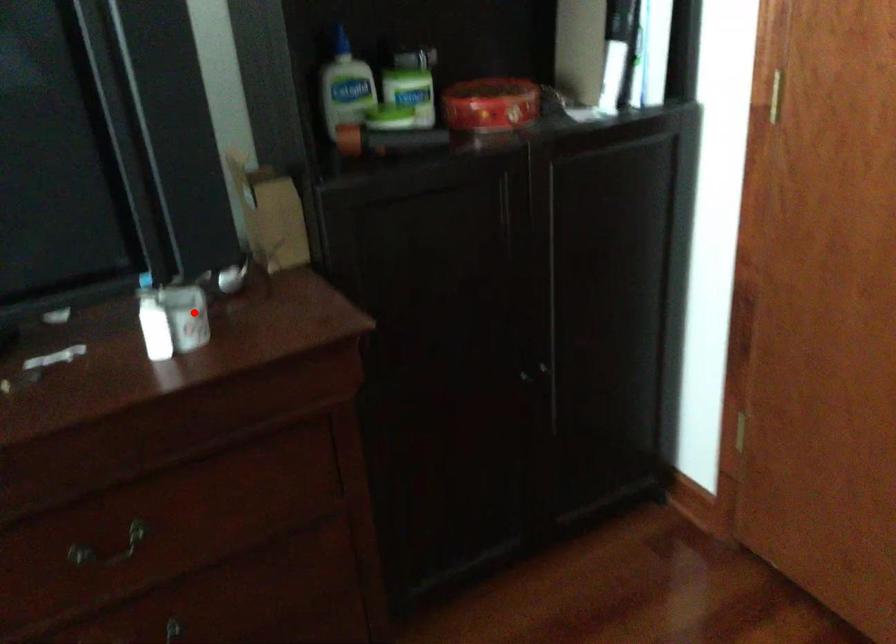
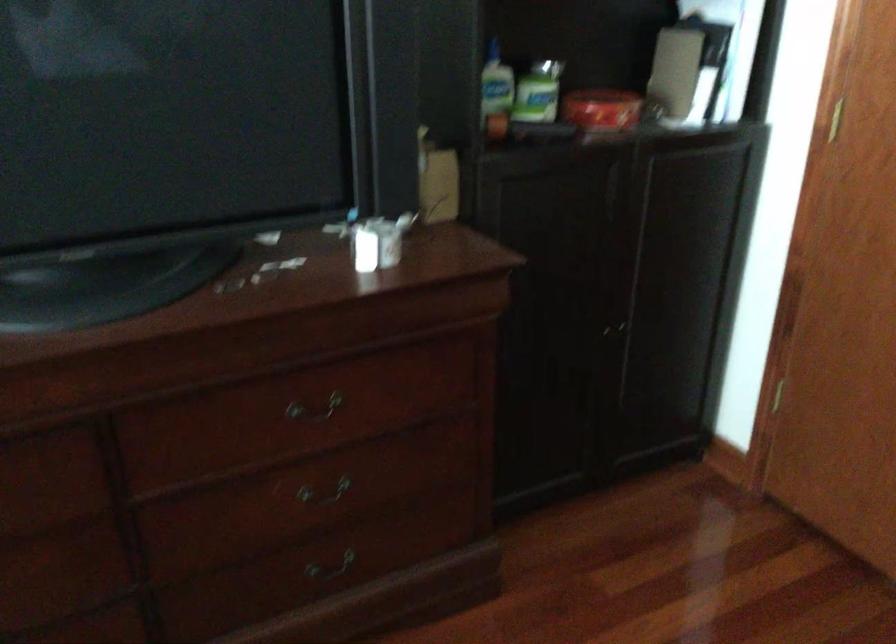
In the second image, find the point that corresponds to the highlighted location in the first image.

(378, 242)